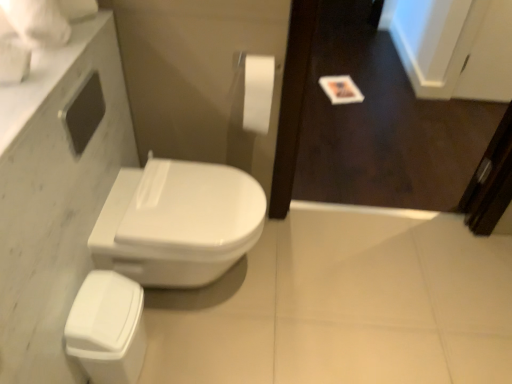
Question: Is white marble countertop at upper left thinner than wooden screen door at upper right?

Choices:
 (A) no
 (B) yes

Answer: (A)

Question: Would you consider white marble countertop at upper left to be distant from wooden screen door at upper right?

Choices:
 (A) yes
 (B) no

Answer: (A)

Question: Is white marble countertop at upper left bigger than wooden screen door at upper right?

Choices:
 (A) yes
 (B) no

Answer: (B)

Question: Is white marble countertop at upper left next to wooden screen door at upper right and touching it?

Choices:
 (A) no
 (B) yes

Answer: (A)

Question: Does white marble countertop at upper left have a lesser height compared to wooden screen door at upper right?

Choices:
 (A) yes
 (B) no

Answer: (A)

Question: Considering the positions of white glossy bidet at center and white marble countertop at upper left in the image, is white glossy bidet at center bigger or smaller than white marble countertop at upper left?

Choices:
 (A) big
 (B) small

Answer: (A)

Question: From the image's perspective, is white glossy bidet at center positioned above or below white marble countertop at upper left?

Choices:
 (A) below
 (B) above

Answer: (A)

Question: In the image, is white glossy bidet at center on the left side or the right side of white marble countertop at upper left?

Choices:
 (A) right
 (B) left

Answer: (A)

Question: Is white glossy bidet at center inside the boundaries of white marble countertop at upper left, or outside?

Choices:
 (A) outside
 (B) inside

Answer: (A)

Question: Choose the correct answer: Is white glossy bidet at center inside white glossy porcelain at lower left or outside it?

Choices:
 (A) inside
 (B) outside

Answer: (B)

Question: From the image's perspective, is white glossy bidet at center above or below white glossy porcelain at lower left?

Choices:
 (A) below
 (B) above

Answer: (B)

Question: Looking at their shapes, would you say white glossy bidet at center is wider or thinner than white glossy porcelain at lower left?

Choices:
 (A) wide
 (B) thin

Answer: (A)

Question: In terms of height, does white glossy bidet at center look taller or shorter compared to white glossy porcelain at lower left?

Choices:
 (A) short
 (B) tall

Answer: (B)

Question: From their relative heights in the image, would you say wooden screen door at upper right is taller or shorter than white marble countertop at upper left?

Choices:
 (A) short
 (B) tall

Answer: (B)

Question: Is wooden screen door at upper right in front of or behind white marble countertop at upper left in the image?

Choices:
 (A) behind
 (B) front

Answer: (A)